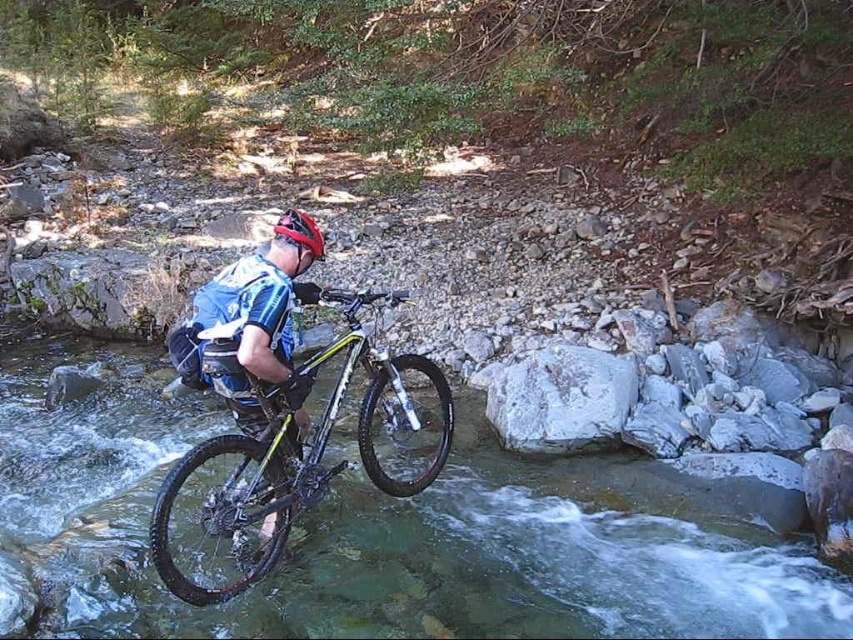
Who is more forward, (573, 628) or (544, 371)?

Point (573, 628) is in front.

Who is taller, clear water at center or white smooth rock at center?

With more height is white smooth rock at center.

Identify the location of clear water at center. The height and width of the screenshot is (640, 853). (380, 538).

Between yellow matte bicycle at center and white smooth rock at center, which one has more height?

Standing taller between the two is yellow matte bicycle at center.

Can you confirm if yellow matte bicycle at center is positioned below white smooth rock at center?

Incorrect, yellow matte bicycle at center is not positioned below white smooth rock at center.

This screenshot has width=853, height=640. Identify the location of yellow matte bicycle at center. (297, 454).

Image resolution: width=853 pixels, height=640 pixels. Identify the location of yellow matte bicycle at center. (297, 454).

Which is above, yellow matte bicycle at center or red matte bicycle helmet at center?

red matte bicycle helmet at center is above.

Is yellow matte bicycle at center shorter than red matte bicycle helmet at center?

Incorrect, yellow matte bicycle at center's height does not fall short of red matte bicycle helmet at center's.

You are a GUI agent. You are given a task and a screenshot of the screen. Output one action in this format:
    pyautogui.click(x=<x>, y=<y>)
    Task: Click on the yellow matte bicycle at center
    This screenshot has width=853, height=640.
    Given the screenshot: What is the action you would take?
    pyautogui.click(x=297, y=454)

This screenshot has height=640, width=853. I want to click on yellow matte bicycle at center, so click(297, 454).